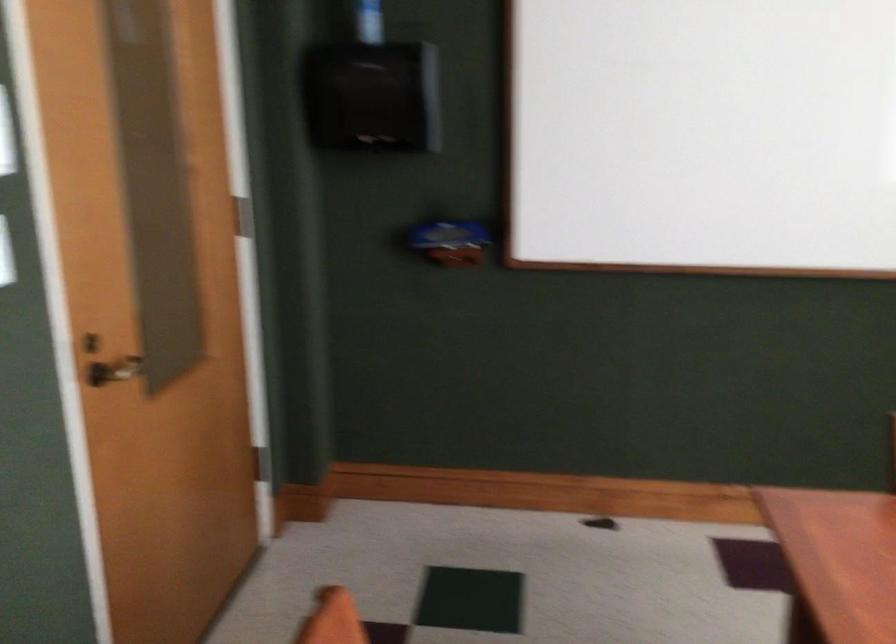
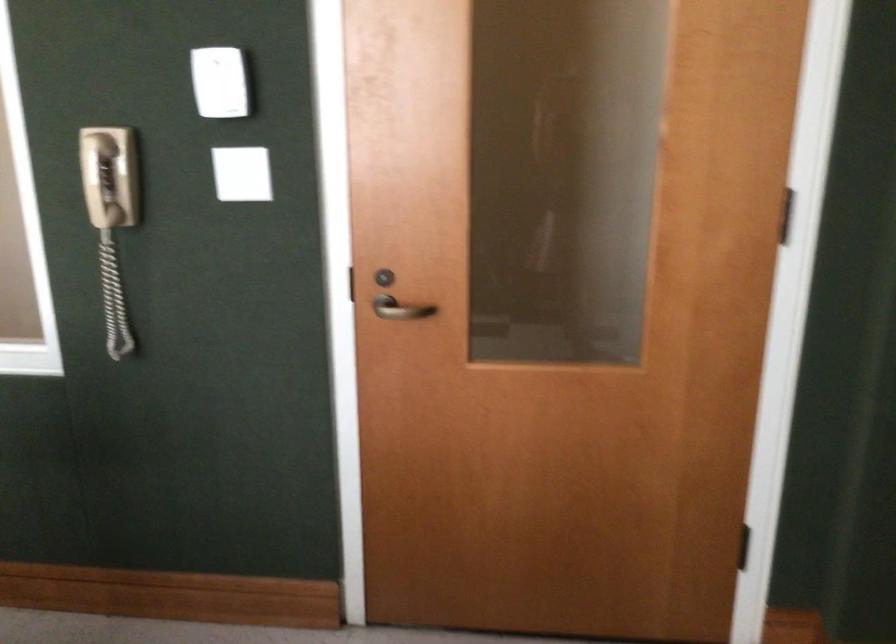
In the second image, find the point that corresponds to (x=125, y=375) in the first image.

(401, 308)